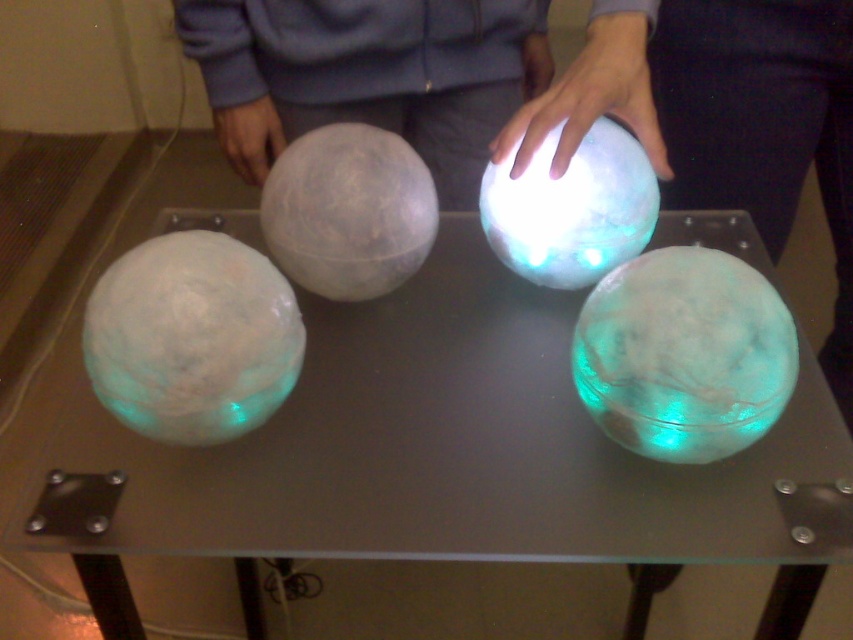
Question: Can you confirm if translucent glass spheres at center is positioned to the left of matte gray sphere at center?

Choices:
 (A) yes
 (B) no

Answer: (B)

Question: Does translucent glass spheres at center have a larger size compared to matte gray sphere at center?

Choices:
 (A) yes
 (B) no

Answer: (A)

Question: Which point is closer to the camera?

Choices:
 (A) matte gray sphere at center
 (B) translucent glass spheres at center

Answer: (B)

Question: Is translucent glass spheres at center to the right of matte gray sphere at center from the viewer's perspective?

Choices:
 (A) yes
 (B) no

Answer: (A)

Question: Among these points, which one is farthest from the camera?

Choices:
 (A) (457, 173)
 (B) (450, 376)

Answer: (A)